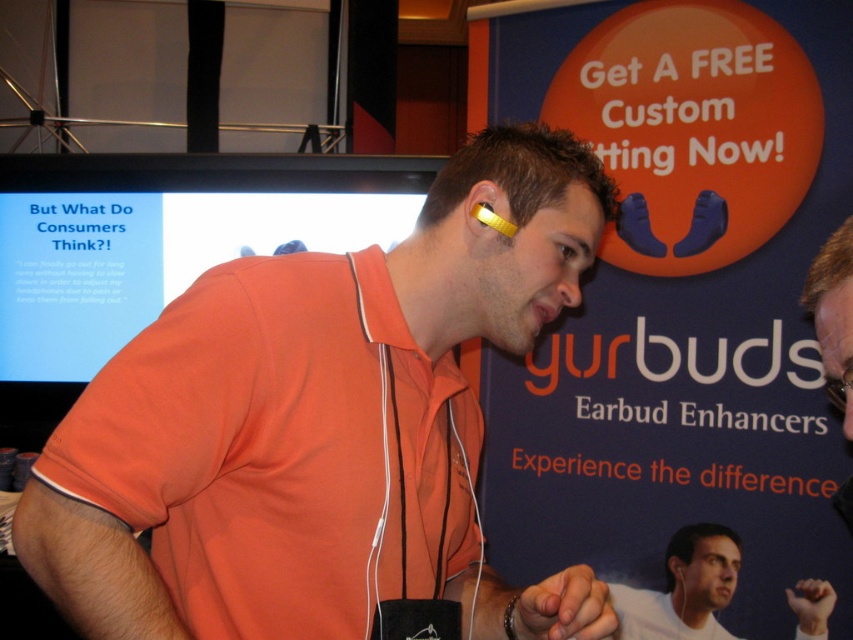
Between yellow matte earbud enhancer at center and matte black screen at upper left, which one has more height?

With more height is matte black screen at upper left.

Can you confirm if yellow matte earbud enhancer at center is thinner than matte black screen at upper left?

Yes, yellow matte earbud enhancer at center is thinner than matte black screen at upper left.

Find the location of a particular element. This screenshot has width=853, height=640. yellow matte earbud enhancer at center is located at coordinates (320, 428).

Describe the element at coordinates (320, 428) in the screenshot. I see `yellow matte earbud enhancer at center` at that location.

Between yellow matte earbud enhancer at center and white matte earbud enhancer at center, which one has more height?

yellow matte earbud enhancer at center is taller.

At what (x,y) coordinates should I click in order to perform the action: click on yellow matte earbud enhancer at center. Please return your answer as a coordinate pair (x, y). Image resolution: width=853 pixels, height=640 pixels. Looking at the image, I should click on (320, 428).

Is matte black earbud enhancer at upper center wider than yellow matte earbud enhancer at upper right?

Incorrect, matte black earbud enhancer at upper center's width does not surpass yellow matte earbud enhancer at upper right's.

Between point (688, 595) and point (495, 218), which one is positioned behind?

The point (688, 595) is behind.

The height and width of the screenshot is (640, 853). Describe the element at coordinates (680, 592) in the screenshot. I see `matte black earbud enhancer at upper center` at that location.

Image resolution: width=853 pixels, height=640 pixels. I want to click on matte black earbud enhancer at upper center, so click(680, 592).